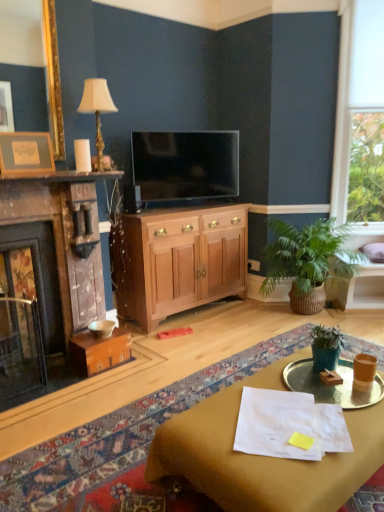
Locate an element on the screen. This screenshot has height=512, width=384. unoccupied area in front of green matte plant pot at center, which is the first houseplant in front-to-back order is located at coordinates (329, 388).